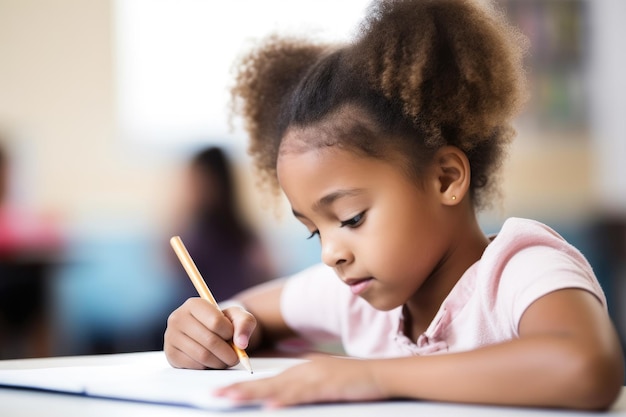
Identify the location of tabletop. The width and height of the screenshot is (626, 417). (38, 402).